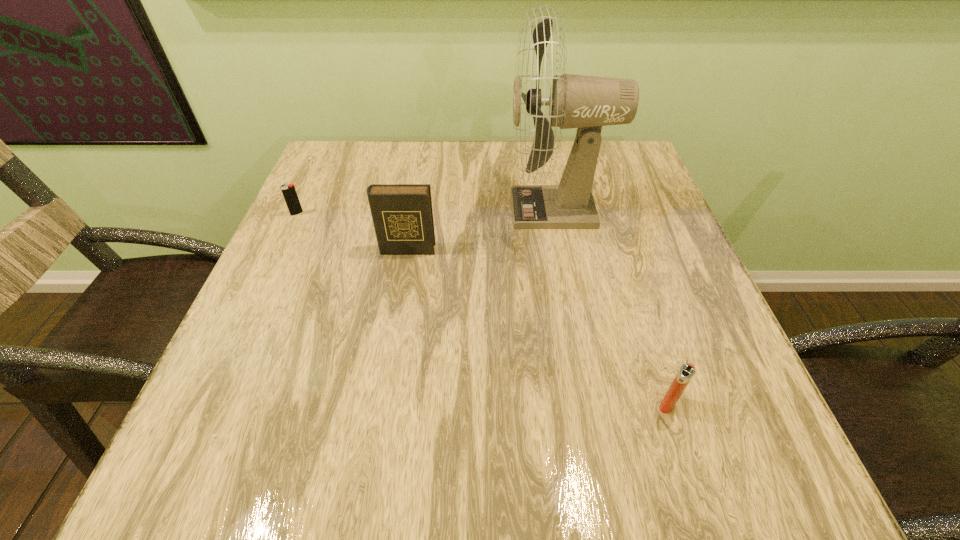
This screenshot has width=960, height=540. Identify the location of vacant area situated 0.150m on the front cover of the second tallest object. (396, 310).

The width and height of the screenshot is (960, 540). Find the location of `vacant space located 0.270m on the back of the taller igniter`. vacant space located 0.270m on the back of the taller igniter is located at coordinates (625, 273).

Find the location of a particular element. The image size is (960, 540). vacant space located 0.080m on the front of the left igniter is located at coordinates (285, 239).

Locate an element on the screen. object that is at the far edge is located at coordinates (576, 101).

The width and height of the screenshot is (960, 540). I want to click on object located at the left edge, so pyautogui.click(x=290, y=195).

Locate an element on the screen. Image resolution: width=960 pixels, height=540 pixels. fan that is positioned at the right edge is located at coordinates (576, 101).

I want to click on igniter present at the right edge, so click(686, 372).

Where is `object that is at the far right corner`? This screenshot has width=960, height=540. object that is at the far right corner is located at coordinates (576, 101).

In the image, there is a desktop. In order to click on free region at the far edge in this screenshot , I will do `click(456, 145)`.

Where is `vacant area at the near edge of the desktop`? This screenshot has height=540, width=960. vacant area at the near edge of the desktop is located at coordinates (343, 469).